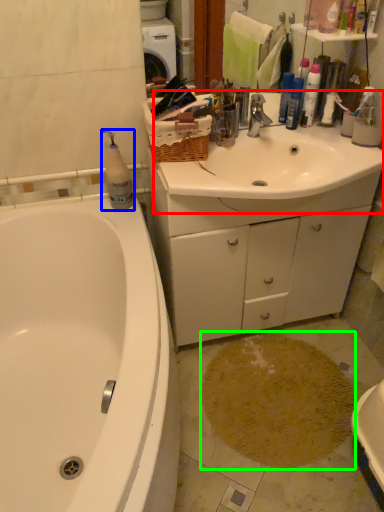
Question: Based on their relative distances, which object is farther from sink (highlighted by a red box)? Choose from cleaning product (highlighted by a blue box) and stain (highlighted by a green box).

Choices:
 (A) cleaning product
 (B) stain

Answer: (B)